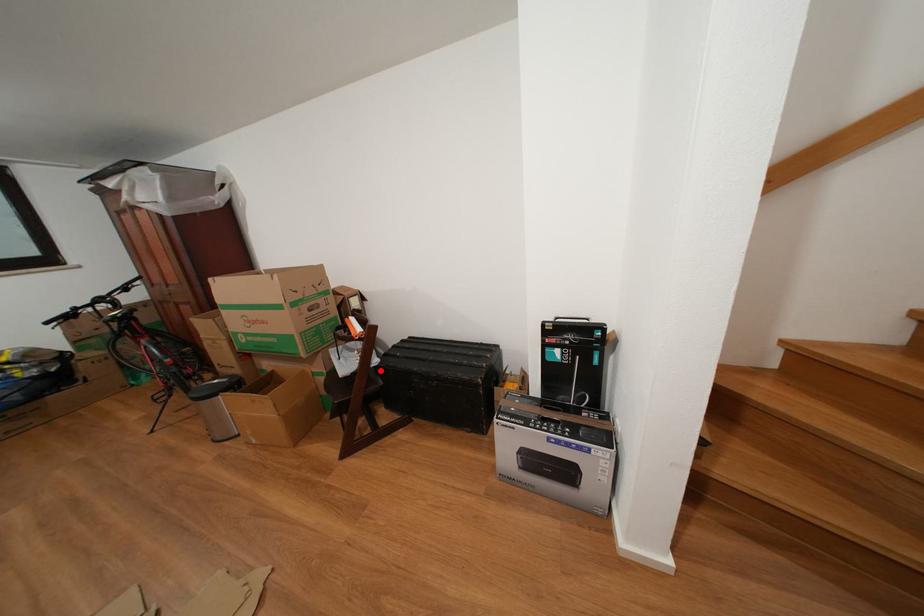
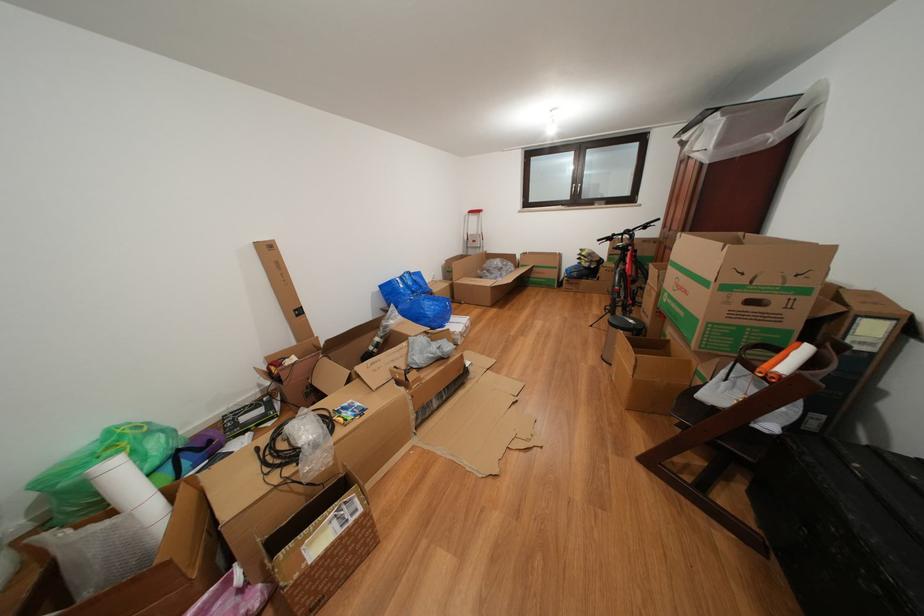
Question: I am providing you with two images of the same scene from different viewpoints. A red point is shown in image1. For the corresponding object point in image2, is it positioned nearer or farther from the camera?

Choices:
 (A) Nearer
 (B) Farther

Answer: (B)